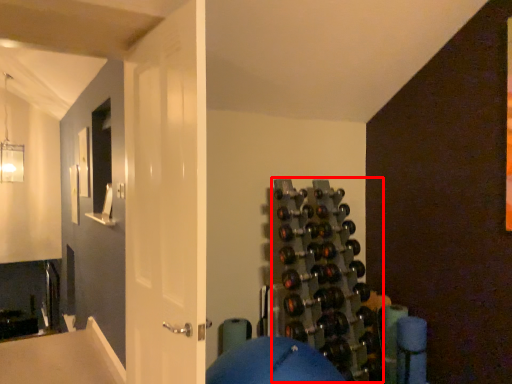
Question: From the image's perspective, where is wine rack (annotated by the red box) located relative to door?

Choices:
 (A) above
 (B) below

Answer: (B)